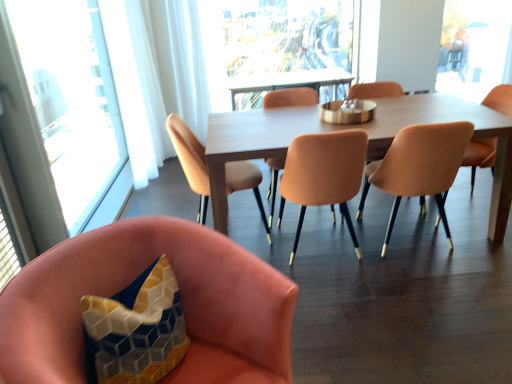
Locate an element on the screen. The image size is (512, 384). free space in front of matte orange chair at center, which appears as the second chair when viewed from the right is located at coordinates (431, 280).